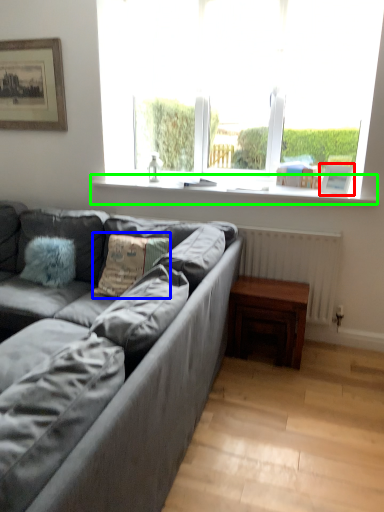
Question: Considering the real-world distances, which object is closest to picture frame (highlighted by a red box)? pillow (highlighted by a blue box) or window sill (highlighted by a green box).

Choices:
 (A) pillow
 (B) window sill

Answer: (B)